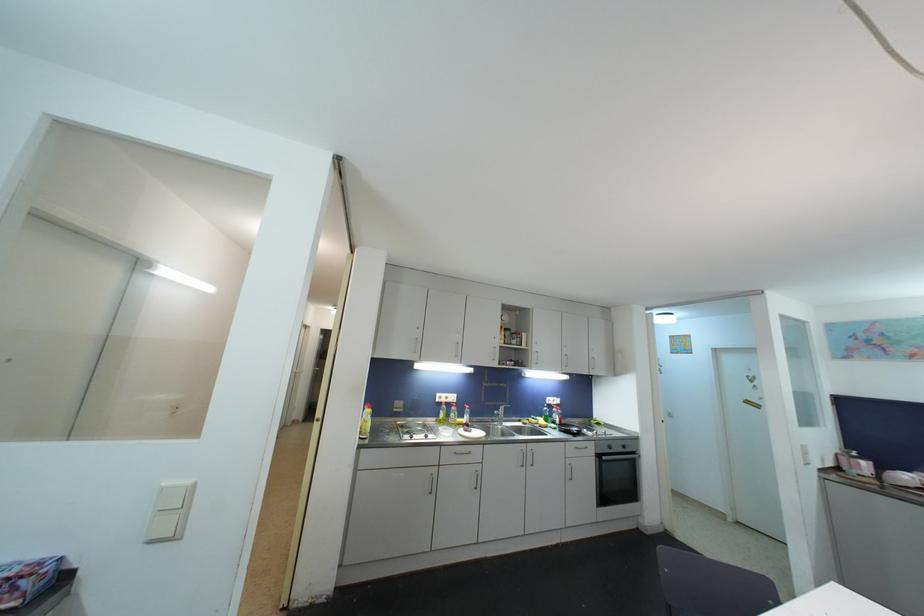
Where is `chair sitting surface`? The image size is (924, 616). chair sitting surface is located at coordinates (711, 586).